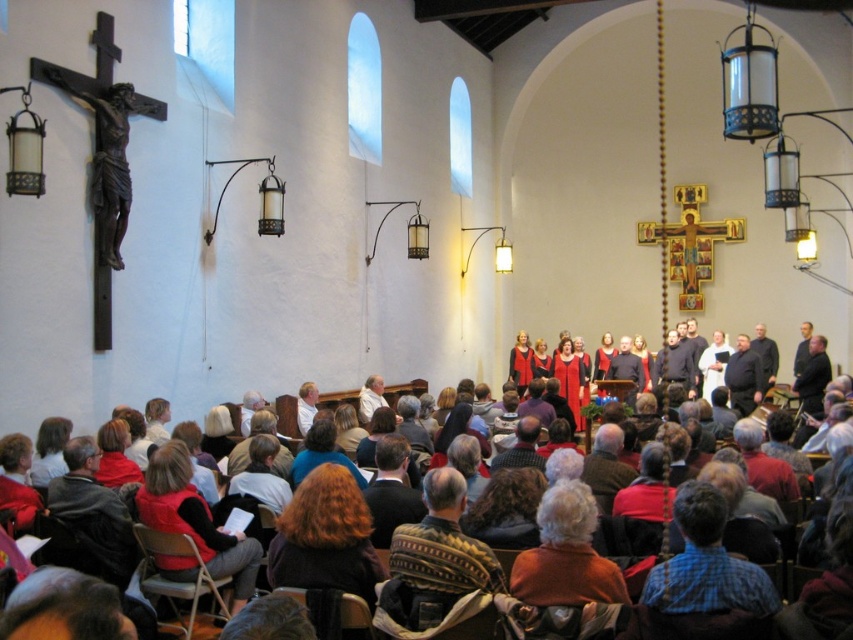
Question: Can you confirm if wooden crucifix at left is wider than red velvet dress at center?

Choices:
 (A) no
 (B) yes

Answer: (A)

Question: Which point is closer to the camera?

Choices:
 (A) (848, 499)
 (B) (120, 232)

Answer: (A)

Question: Which point is farther from the camera taking this photo?

Choices:
 (A) (117, 240)
 (B) (811, 632)

Answer: (A)

Question: Is wooden crucifix at left to the left of red velvet dress at center from the viewer's perspective?

Choices:
 (A) no
 (B) yes

Answer: (B)

Question: Is wooden crucifix at left closer to the viewer compared to red velvet dress at center?

Choices:
 (A) no
 (B) yes

Answer: (A)